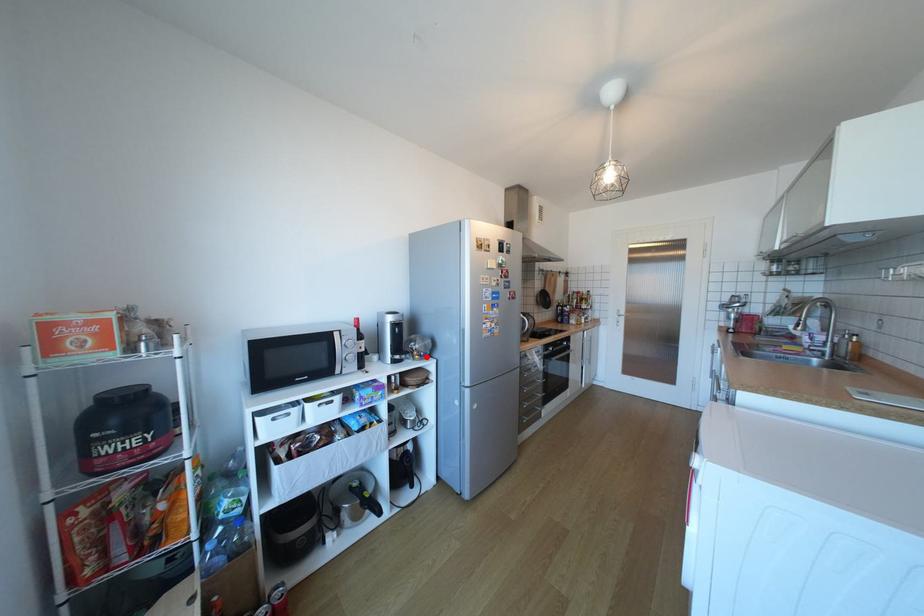
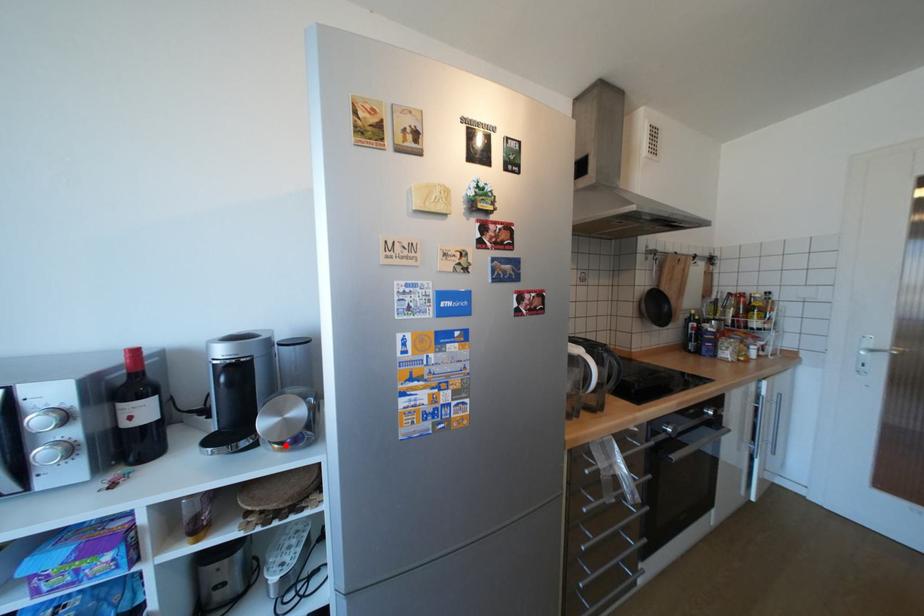
I am providing you with two images of the same scene from different viewpoints. A red point is marked on the first image and another point is marked on the second image. Do the highlighted points in image1 and image2 indicate the same real-world spot?

Yes